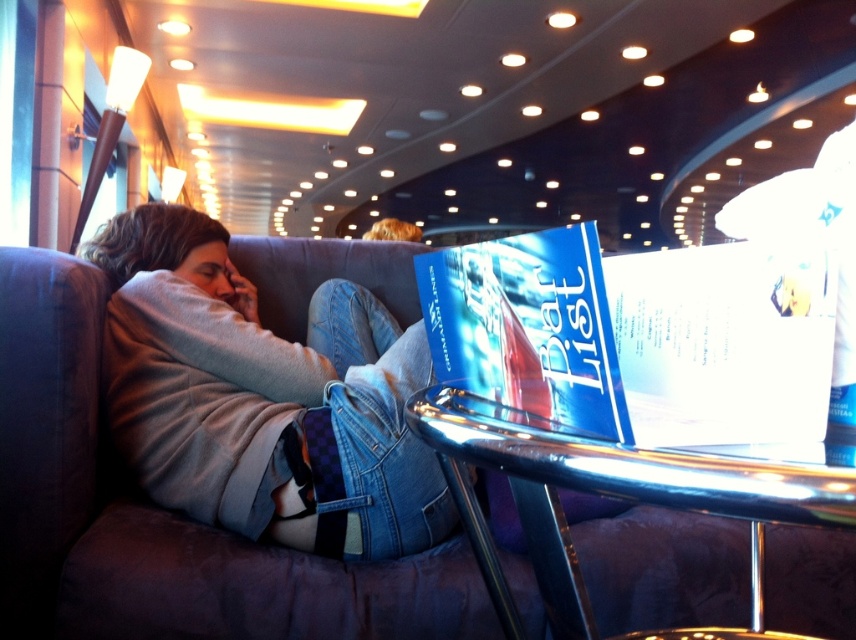
From the picture: Is blue glossy book at center wider than shiny metallic table at lower center?

Incorrect, blue glossy book at center's width does not surpass shiny metallic table at lower center's.

Which is more to the right, blue glossy book at center or shiny metallic table at lower center?

shiny metallic table at lower center is more to the right.

This screenshot has height=640, width=856. Identify the location of blue glossy book at center. (635, 337).